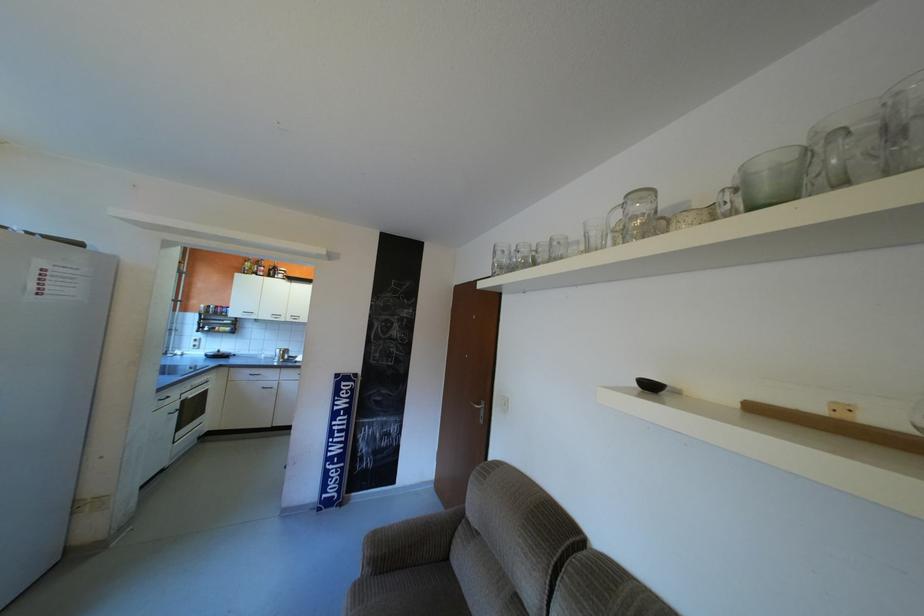
Image resolution: width=924 pixels, height=616 pixels. What are the coordinates of `sofa sitting surface` in the screenshot? It's located at (419, 594).